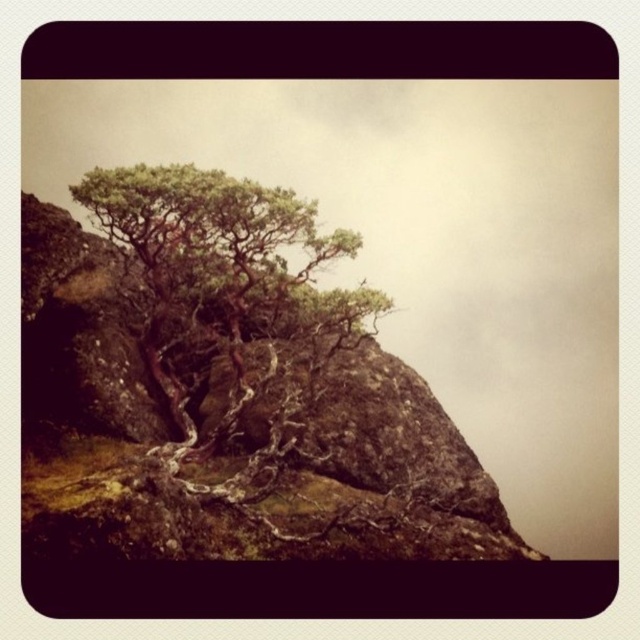
Question: Does green mossy rock at upper center have a smaller size compared to green textured tree at center?

Choices:
 (A) no
 (B) yes

Answer: (A)

Question: Can you confirm if green mossy rock at upper center is positioned above green textured tree at center?

Choices:
 (A) no
 (B) yes

Answer: (A)

Question: Which of the following is the farthest from the observer?

Choices:
 (A) (465, 500)
 (B) (227, 250)

Answer: (A)

Question: Can you confirm if green mossy rock at upper center is positioned to the right of green textured tree at center?

Choices:
 (A) yes
 (B) no

Answer: (A)